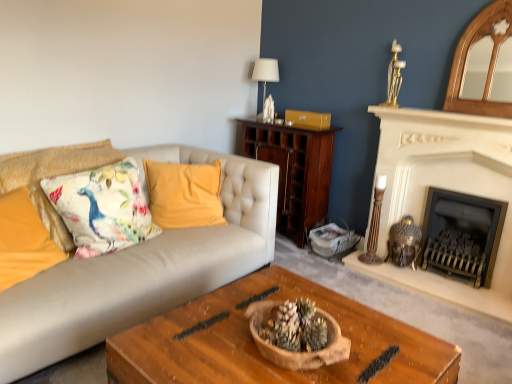
Question: Does white stone fireplace at right, positioned as the 1th fireplace in left-to-right order, have a greater height compared to wooden bowl at center?

Choices:
 (A) yes
 (B) no

Answer: (A)

Question: Are white stone fireplace at right, arranged as the 2th fireplace when viewed from the right, and wooden bowl at center making contact?

Choices:
 (A) yes
 (B) no

Answer: (B)

Question: Is white stone fireplace at right, positioned as the 1th fireplace in left-to-right order, turned away from wooden bowl at center?

Choices:
 (A) no
 (B) yes

Answer: (A)

Question: Is white stone fireplace at right, arranged as the 2th fireplace when viewed from the right, not close to wooden bowl at center?

Choices:
 (A) yes
 (B) no

Answer: (A)

Question: From a real-world perspective, is white stone fireplace at right, arranged as the 2th fireplace when viewed from the right, under wooden bowl at center?

Choices:
 (A) yes
 (B) no

Answer: (B)

Question: From the image's perspective, is white stone fireplace at right, arranged as the 2th fireplace when viewed from the right, located beneath wooden bowl at center?

Choices:
 (A) no
 (B) yes

Answer: (A)

Question: Does dark wood cabinet at center turn towards velvet yellow pillow at center, the 3th pillow when ordered from left to right?

Choices:
 (A) no
 (B) yes

Answer: (B)

Question: Does dark wood cabinet at center have a smaller size compared to velvet yellow pillow at center, the 3th pillow when ordered from left to right?

Choices:
 (A) no
 (B) yes

Answer: (A)

Question: Is velvet yellow pillow at center, which is the 1th pillow from right to left, surrounded by dark wood cabinet at center?

Choices:
 (A) yes
 (B) no

Answer: (B)

Question: Can you confirm if dark wood cabinet at center is wider than velvet yellow pillow at center, the 3th pillow when ordered from left to right?

Choices:
 (A) no
 (B) yes

Answer: (B)

Question: Is dark wood cabinet at center taller than velvet yellow pillow at center, the 3th pillow when ordered from left to right?

Choices:
 (A) no
 (B) yes

Answer: (B)

Question: Is dark wood cabinet at center bigger than velvet yellow pillow at center, the 3th pillow when ordered from left to right?

Choices:
 (A) no
 (B) yes

Answer: (B)

Question: Does velvet yellow pillow at center, the 3th pillow when ordered from left to right, touch floral fabric cushion at left, which ranks as the 1th pillow in left-to-right order?

Choices:
 (A) no
 (B) yes

Answer: (A)